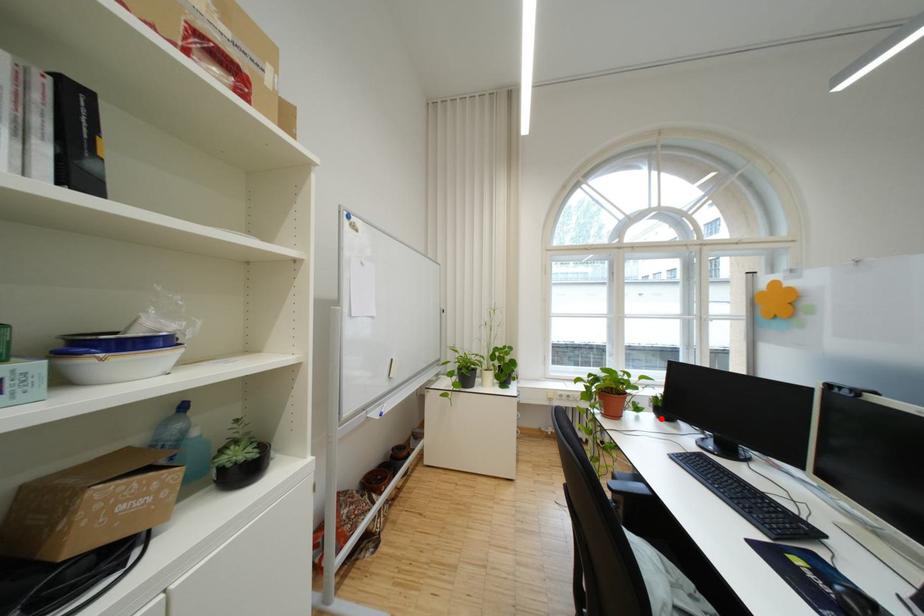
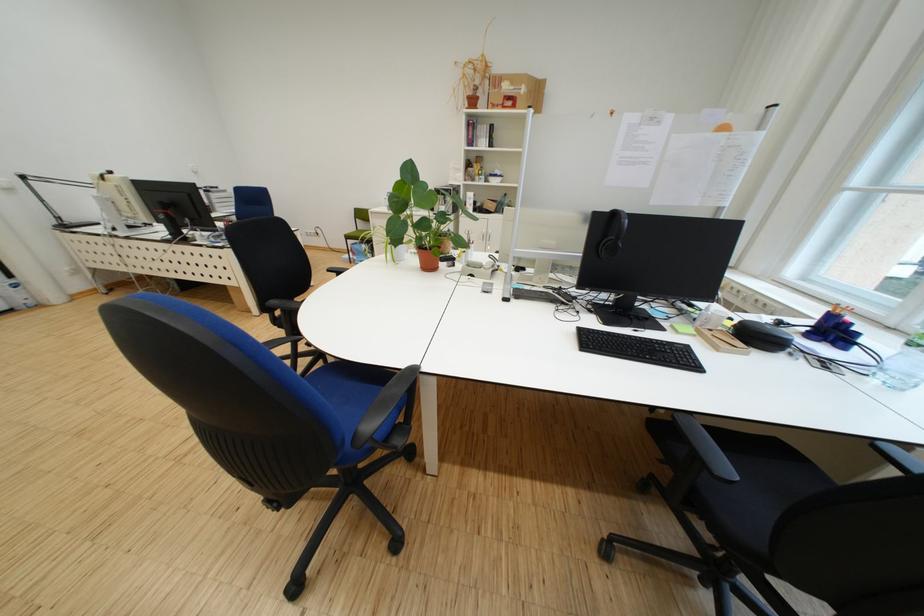
Question: I am providing you with two images of the same scene from different viewpoints. A red point is marked on the first image. At the location where the point appears in image 1, is it still visible in image 2?

Choices:
 (A) Yes
 (B) No

Answer: (B)